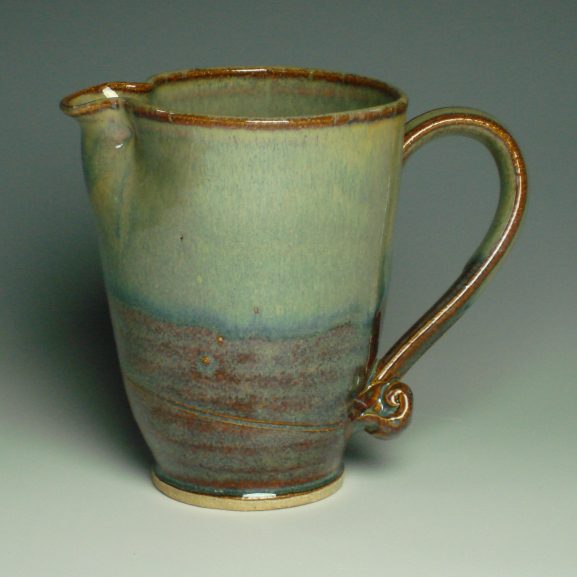
The image size is (577, 577). I want to click on inside of cup, so click(277, 97).